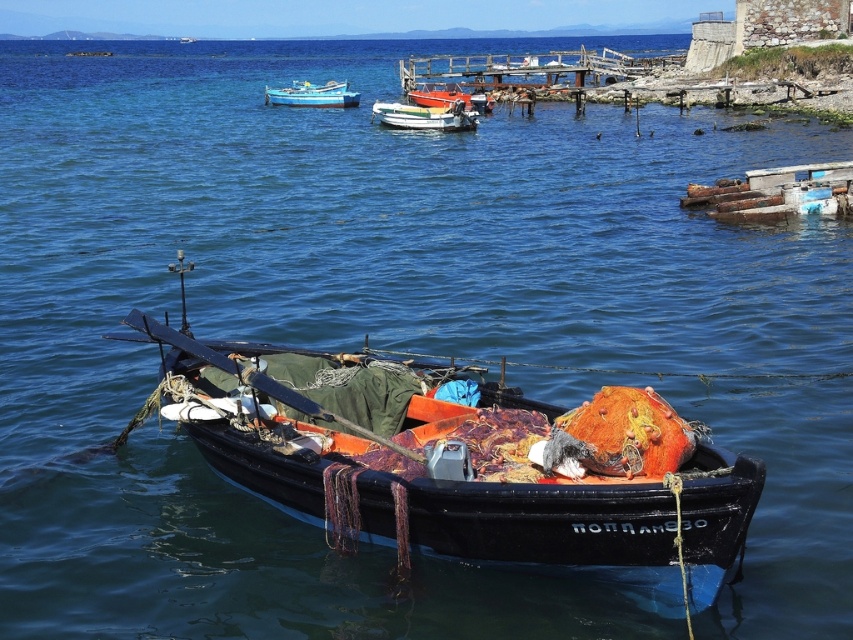
Question: Which object is farther from the camera taking this photo?

Choices:
 (A) blue painted wooden boat at upper center
 (B) white glossy boat at center

Answer: (A)

Question: Is black wooden boat at center above orange fabric boat at center?

Choices:
 (A) yes
 (B) no

Answer: (B)

Question: Can you confirm if black wooden boat at center is positioned below orange fabric boat at center?

Choices:
 (A) yes
 (B) no

Answer: (A)

Question: Estimate the real-world distances between objects in this image. Which object is farther from the black wooden boat at center?

Choices:
 (A) white glossy boat at center
 (B) blue painted wooden boat at upper center

Answer: (B)

Question: Can you confirm if white glossy boat at center is thinner than blue painted wooden boat at upper center?

Choices:
 (A) no
 (B) yes

Answer: (B)

Question: Which point is farther to the camera?

Choices:
 (A) black wooden boat at center
 (B) white glossy boat at center

Answer: (B)